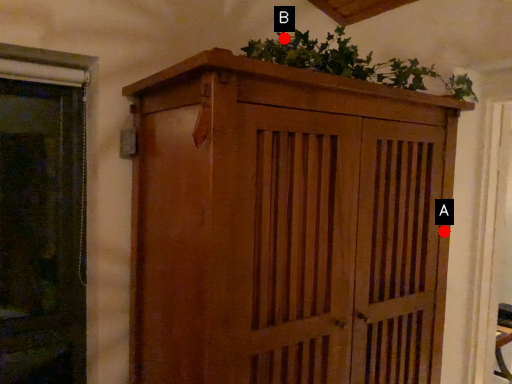
Question: Two points are circled on the image, labeled by A and B beside each circle. Among these points, which one is farthest from the camera?

Choices:
 (A) A is further
 (B) B is further

Answer: (A)